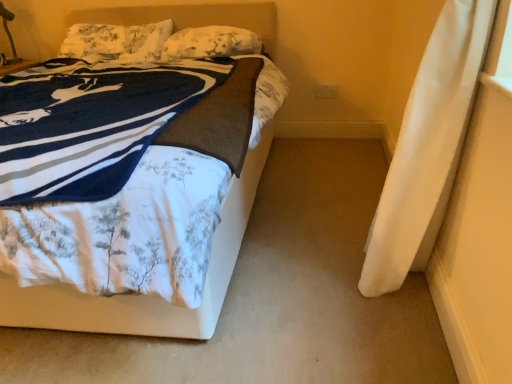
Question: Is fluffy white pillow at upper center, placed as the 1th pillow when sorted from right to left, bigger or smaller than metallic gold table lamp at upper left?

Choices:
 (A) small
 (B) big

Answer: (B)

Question: Is point (211, 51) closer or farther from the camera than point (12, 16)?

Choices:
 (A) closer
 (B) farther

Answer: (A)

Question: Considering the real-world distances, which object is closest to the fluffy white pillow at upper center, placed as the 1th pillow when sorted from right to left?

Choices:
 (A) metallic gold table lamp at upper left
 (B) white floral fabric bed at upper left
 (C) fluffy white pillow at upper left, which ranks as the 2th pillow in right-to-left order

Answer: (C)

Question: Estimate the real-world distances between objects in this image. Which object is closer to the fluffy white pillow at upper left, which ranks as the 2th pillow in right-to-left order?

Choices:
 (A) metallic gold table lamp at upper left
 (B) fluffy white pillow at upper center, arranged as the 2th pillow when viewed from the left
 (C) white floral fabric bed at upper left

Answer: (B)